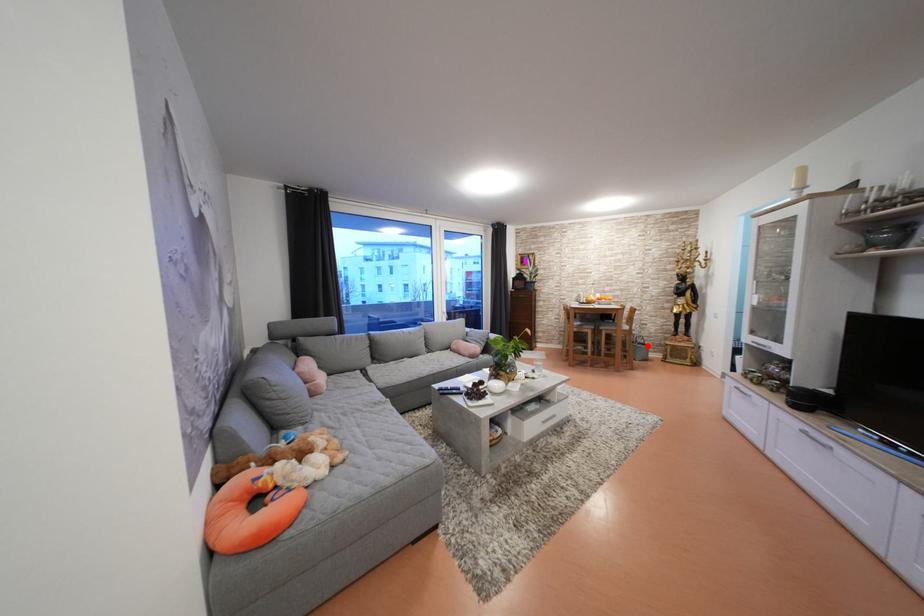
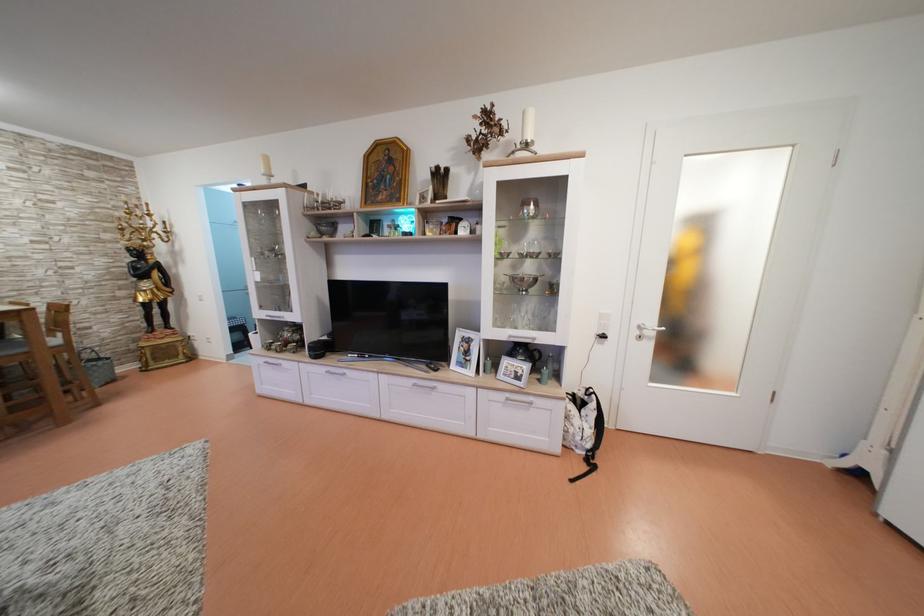
Question: I am providing you with two images of the same scene from different viewpoints. A red point is shown in image1. For the corresponding object point in image2, is it positioned nearer or farther from the camera?

Choices:
 (A) Nearer
 (B) Farther

Answer: (B)